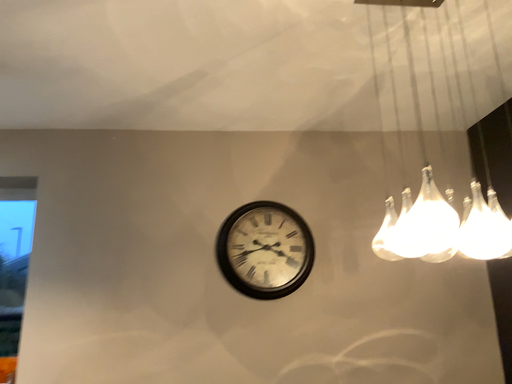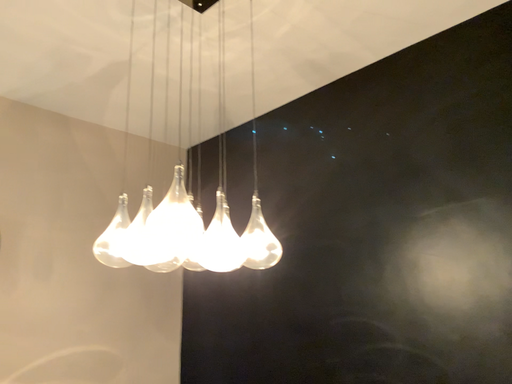
Question: How did the camera likely rotate when shooting the video?

Choices:
 (A) rotated right
 (B) rotated left

Answer: (A)